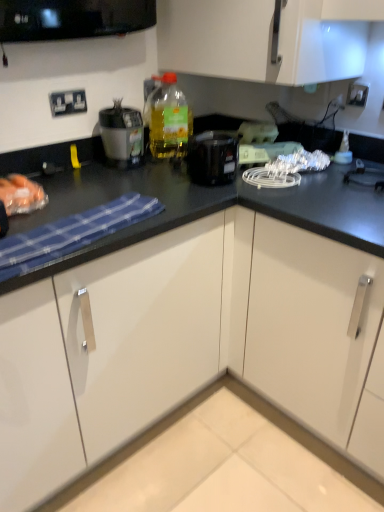
Question: Can you confirm if white glossy cabinet at lower center is positioned to the left of translucent plastic bottle at upper center?

Choices:
 (A) yes
 (B) no

Answer: (A)

Question: Is white glossy cabinet at lower center thinner than translucent plastic bottle at upper center?

Choices:
 (A) yes
 (B) no

Answer: (B)

Question: Considering the relative sizes of white glossy cabinet at lower center and translucent plastic bottle at upper center in the image provided, is white glossy cabinet at lower center smaller than translucent plastic bottle at upper center?

Choices:
 (A) yes
 (B) no

Answer: (B)

Question: From a real-world perspective, is white glossy cabinet at lower center beneath translucent plastic bottle at upper center?

Choices:
 (A) no
 (B) yes

Answer: (B)

Question: Does white glossy cabinet at lower center appear on the right side of translucent plastic bottle at upper center?

Choices:
 (A) yes
 (B) no

Answer: (B)

Question: Can you confirm if white glossy cabinet at lower center is bigger than translucent plastic bottle at upper center?

Choices:
 (A) yes
 (B) no

Answer: (A)

Question: Is matte black blender at upper left behind white glossy cabinet at lower center?

Choices:
 (A) yes
 (B) no

Answer: (A)

Question: Is matte black blender at upper left wider than white glossy cabinet at lower center?

Choices:
 (A) yes
 (B) no

Answer: (B)

Question: Does matte black blender at upper left have a lesser height compared to white glossy cabinet at lower center?

Choices:
 (A) no
 (B) yes

Answer: (A)

Question: Are matte black blender at upper left and white glossy cabinet at lower center located far from each other?

Choices:
 (A) yes
 (B) no

Answer: (B)

Question: Is matte black blender at upper left with white glossy cabinet at lower center?

Choices:
 (A) no
 (B) yes

Answer: (A)

Question: Would you say matte black blender at upper left is outside white glossy cabinet at lower center?

Choices:
 (A) yes
 (B) no

Answer: (A)

Question: Is black plastic coffee maker at center far from white plastic electrical outlet at upper left, which is the 1th electric outlet from left to right?

Choices:
 (A) yes
 (B) no

Answer: (B)